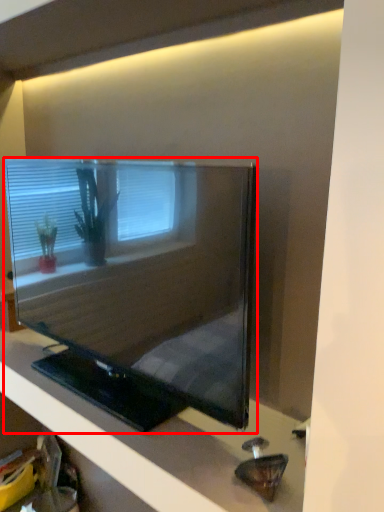
Question: From the image's perspective, what is the correct spatial positioning of television (annotated by the red box) in reference to furniture?

Choices:
 (A) above
 (B) below

Answer: (A)